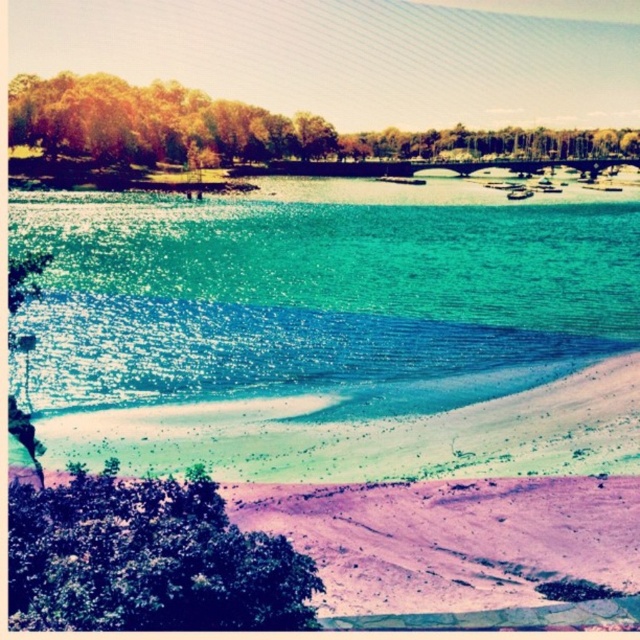
Question: Considering the real-world distances, which object is closest to the green leafy tree at upper center?

Choices:
 (A) translucent teal water at center
 (B) green leafy trees at upper center

Answer: (B)

Question: Is green leafy tree at lower left positioned at the back of green leafy trees at upper center?

Choices:
 (A) yes
 (B) no

Answer: (B)

Question: Can you confirm if translucent teal water at center is positioned below green leafy trees at upper center?

Choices:
 (A) no
 (B) yes

Answer: (B)

Question: Is green leafy tree at lower left to the right of green leafy trees at upper center from the viewer's perspective?

Choices:
 (A) no
 (B) yes

Answer: (A)

Question: Which object is closer to the camera taking this photo?

Choices:
 (A) green leafy trees at upper center
 (B) translucent teal water at center
 (C) green leafy tree at lower left
 (D) green leafy tree at upper center

Answer: (C)

Question: Which is nearer to the green leafy tree at lower left?

Choices:
 (A) green leafy tree at upper center
 (B) green leafy trees at upper center

Answer: (B)